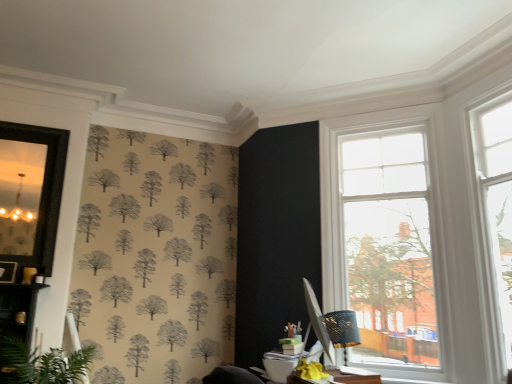
Question: From the image's perspective, is clear glass window at upper right, which is the 1th window in left-to-right order, located above or below matte black lampshade at right?

Choices:
 (A) above
 (B) below

Answer: (A)

Question: Is point (428, 327) closer or farther from the camera than point (330, 311)?

Choices:
 (A) farther
 (B) closer

Answer: (B)

Question: Which object is the closest to the clear glass window at upper right, the first window in the right-to-left sequence?

Choices:
 (A) matte black lampshade at right
 (B) matte black mirror at left
 (C) green leafy plant at lower left
 (D) clear glass window at upper right, which is the 1th window in left-to-right order

Answer: (D)

Question: Which of these objects is positioned farthest from the clear glass window at upper right, which is the 1th window in left-to-right order?

Choices:
 (A) matte black mirror at left
 (B) green leafy plant at lower left
 (C) clear glass window at upper right, the first window in the right-to-left sequence
 (D) matte black lampshade at right

Answer: (A)